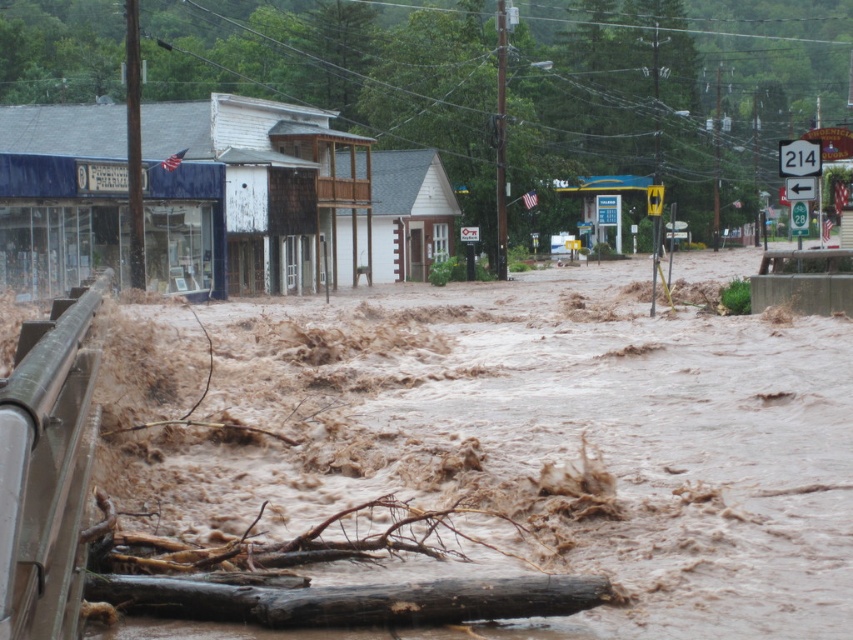
Question: Based on their relative distances, which object is nearer to the white wooden building at center?

Choices:
 (A) brown rough wood log at lower center
 (B) brown muddy water at lower left

Answer: (B)

Question: Which object appears farthest from the camera in this image?

Choices:
 (A) brown rough wood log at lower center
 (B) white wooden building at center
 (C) brown muddy water at lower left

Answer: (B)

Question: Which point is closer to the camera taking this photo?

Choices:
 (A) (x=305, y=154)
 (B) (x=505, y=588)

Answer: (B)

Question: Is brown muddy water at lower left further to camera compared to white wooden building at center?

Choices:
 (A) no
 (B) yes

Answer: (A)

Question: Is brown muddy water at lower left smaller than brown rough wood log at lower center?

Choices:
 (A) yes
 (B) no

Answer: (B)

Question: Is brown muddy water at lower left thinner than brown rough wood log at lower center?

Choices:
 (A) yes
 (B) no

Answer: (B)